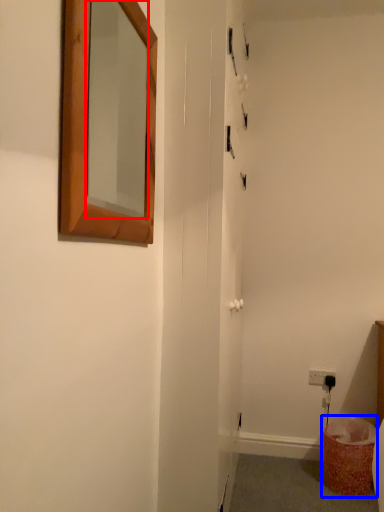
Question: Which of the following is the closest to the observer, mirror (highlighted by a red box) or laundry basket (highlighted by a blue box)?

Choices:
 (A) mirror
 (B) laundry basket

Answer: (A)